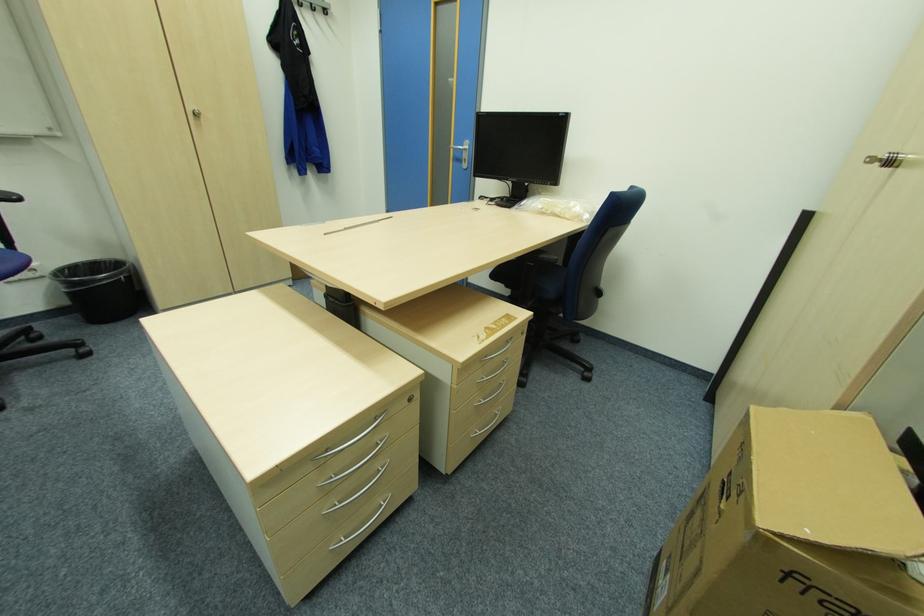
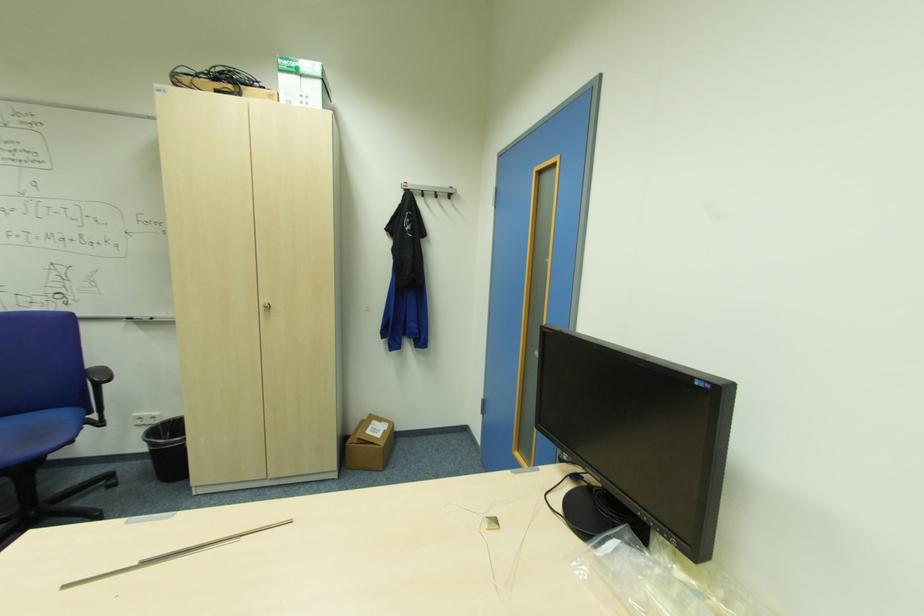
Locate, in the second image, the point that corresponds to point (201, 115) in the first image.

(271, 307)